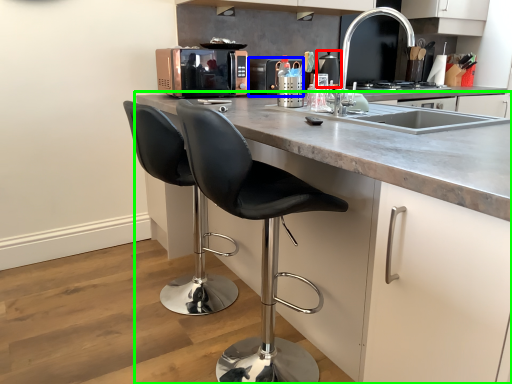
Question: Which object is the farthest from appliance (highlighted by a red box)? Choose among these: kitchen appliance (highlighted by a blue box) or cabinetry (highlighted by a green box).

Choices:
 (A) kitchen appliance
 (B) cabinetry

Answer: (B)